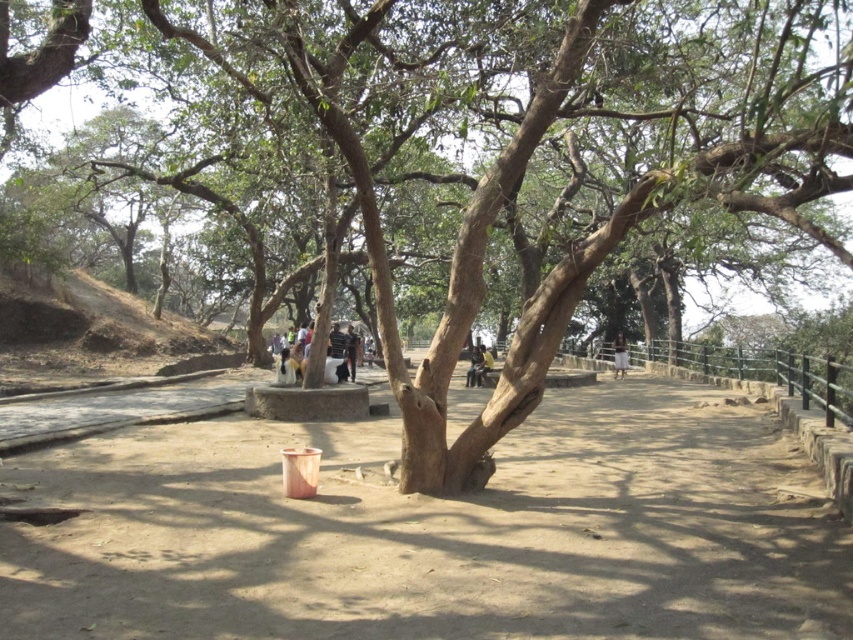
Does brown sandy dirt at center have a smaller size compared to dark blue shirt at center?

Incorrect, brown sandy dirt at center is not smaller in size than dark blue shirt at center.

Is point (253, 621) positioned before point (292, 349)?

Yes, point (253, 621) is in front of point (292, 349).

You are a GUI agent. You are given a task and a screenshot of the screen. Output one action in this format:
    pyautogui.click(x=<x>, y=<y>)
    Task: Click on the brown sandy dirt at center
    The width and height of the screenshot is (853, 640).
    Given the screenshot: What is the action you would take?
    pyautogui.click(x=438, y=531)

Is point (329, 349) farther from camera compared to point (613, 369)?

No, (329, 349) is closer to viewer.

Between dark blue shirt at center and white cotton pants at center, which one appears on the left side from the viewer's perspective?

dark blue shirt at center is more to the left.

Between point (306, 355) and point (621, 348), which one is positioned in front?

Point (306, 355) is more forward.

In order to click on dark blue shirt at center in this screenshot , I will do `click(335, 365)`.

Who is lower down, brown sandy dirt at center or dark blue jeans at center?

brown sandy dirt at center is below.

Is point (689, 513) positioned before point (480, 376)?

Yes, point (689, 513) is in front of point (480, 376).

Is point (689, 616) more distant than point (490, 369)?

That is False.

Locate an element on the screen. Image resolution: width=853 pixels, height=640 pixels. brown sandy dirt at center is located at coordinates (438, 531).